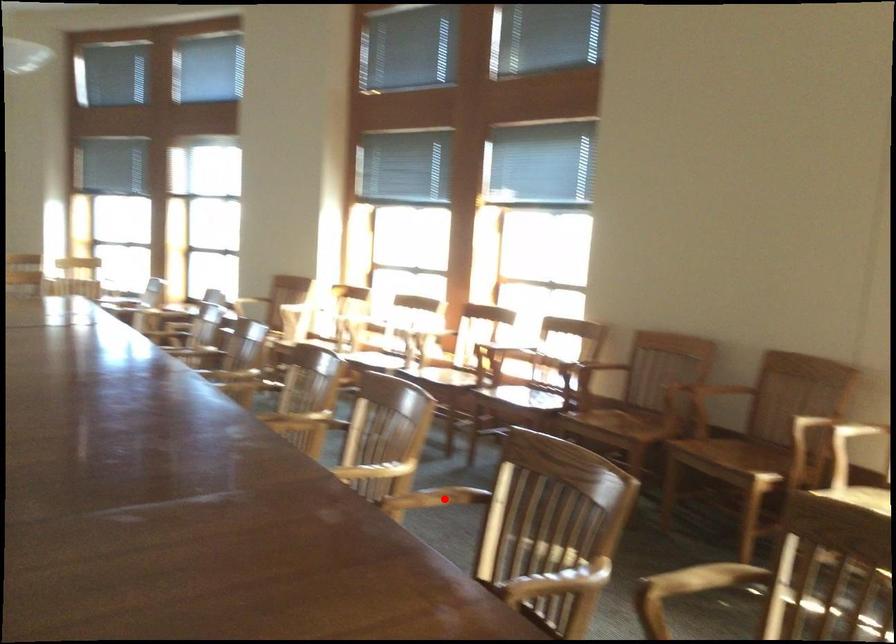
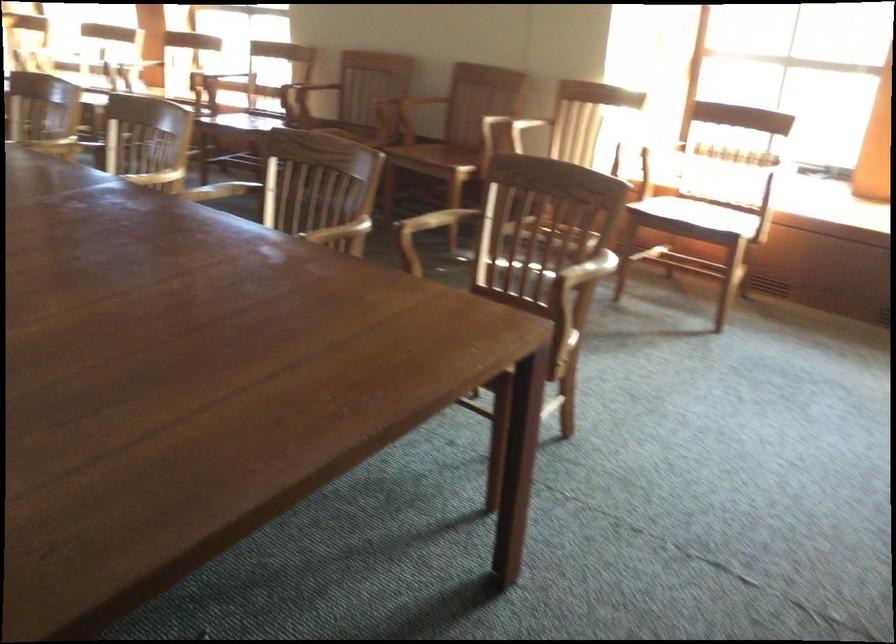
Question: I am providing you with two images of the same scene from different viewpoints. Given a red point in image1, look at the same physical point in image2. Is it:

Choices:
 (A) Closer to the viewpoint
 (B) Farther from the viewpoint

Answer: (B)